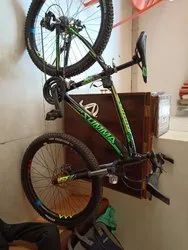
Identify the location of wall. pyautogui.click(x=16, y=15), pyautogui.click(x=174, y=213).